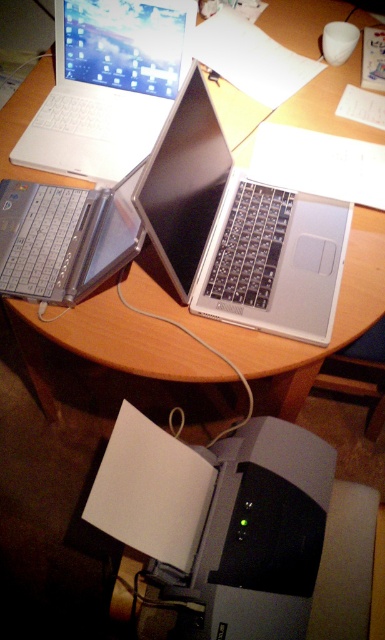
You are organizing the laptops on the table. You need to place a new laptop between the silver metallic laptop at upper left and the silver metallic laptop at left. Is this possible?

The silver metallic laptop at upper left is positioned on the right side of silver metallic laptop at left, meaning there is no space between them. Therefore, you cannot place a new laptop between them.

You are standing in front of the workspace with three laptops. You notice two points marked on the table. One is at point (68, 45) and the other at point (125, 240). Which point is closer to you?

Point (68, 45) is closer to you because it is further to the viewer than point (125, 240).